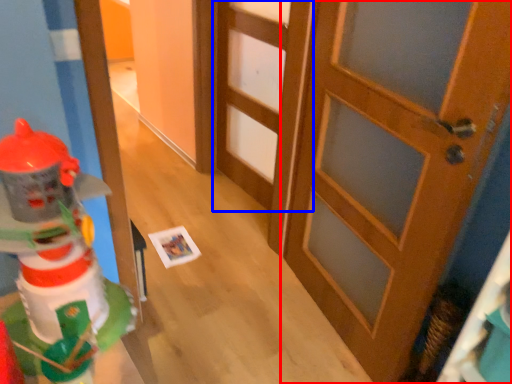
Question: Which of the following is the closest to the observer, door (highlighted by a red box) or door (highlighted by a blue box)?

Choices:
 (A) door
 (B) door

Answer: (A)